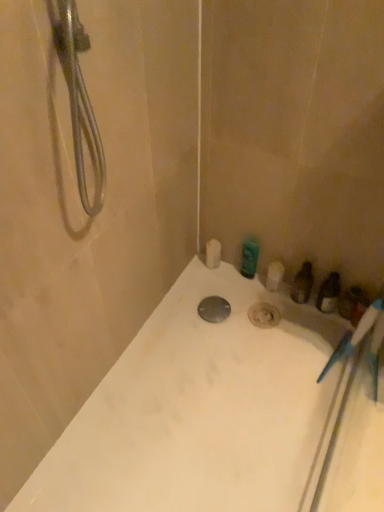
I want to click on vacant area located to the right-hand side of metallic silver drain at center, so click(258, 316).